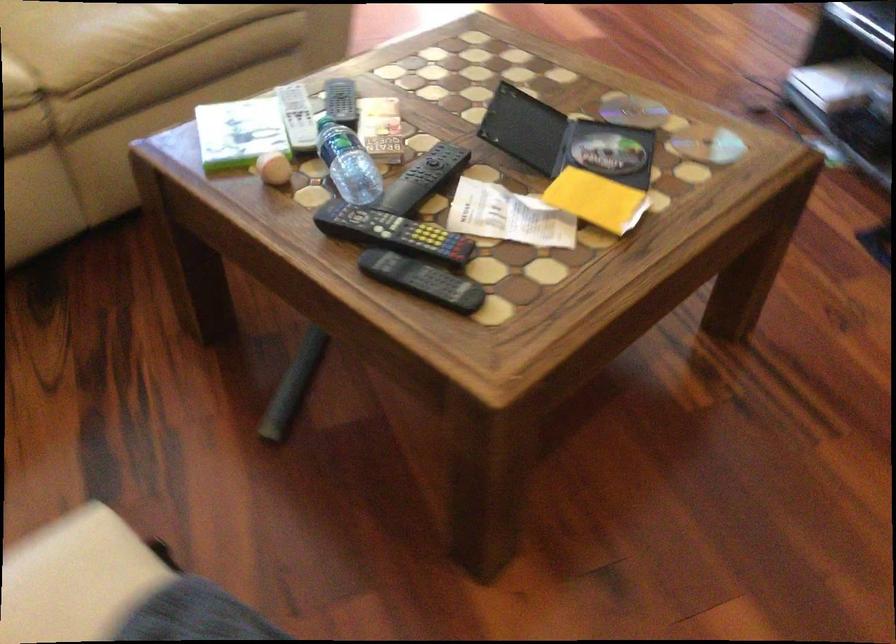
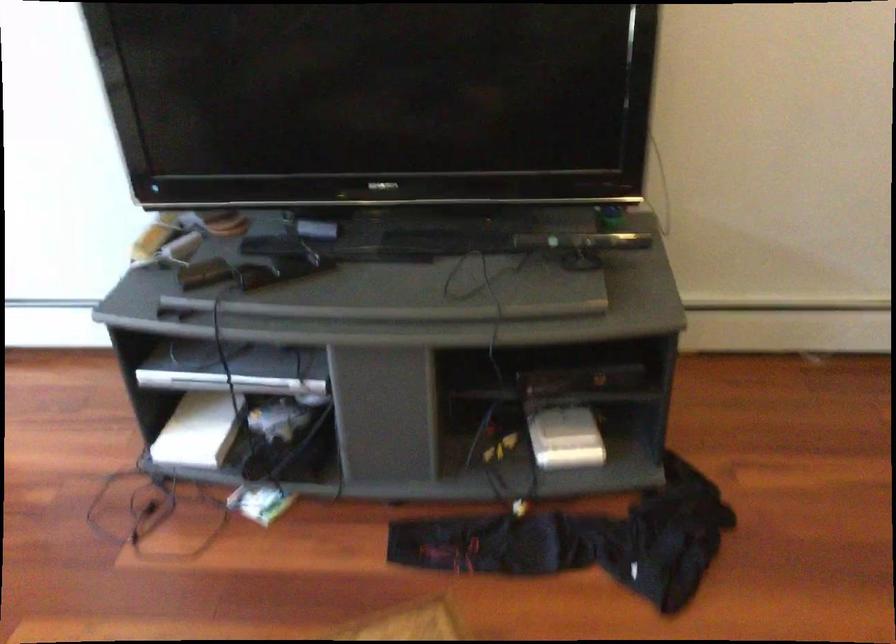
Locate, in the second image, the point that corresponds to pixel 819 82 in the first image.

(199, 430)